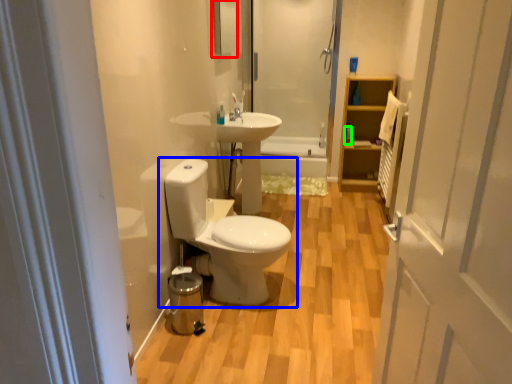
Question: Considering the real-world distances, which object is farthest from mirror (highlighted by a red box)? toilet (highlighted by a blue box) or toiletry (highlighted by a green box)?

Choices:
 (A) toilet
 (B) toiletry

Answer: (B)